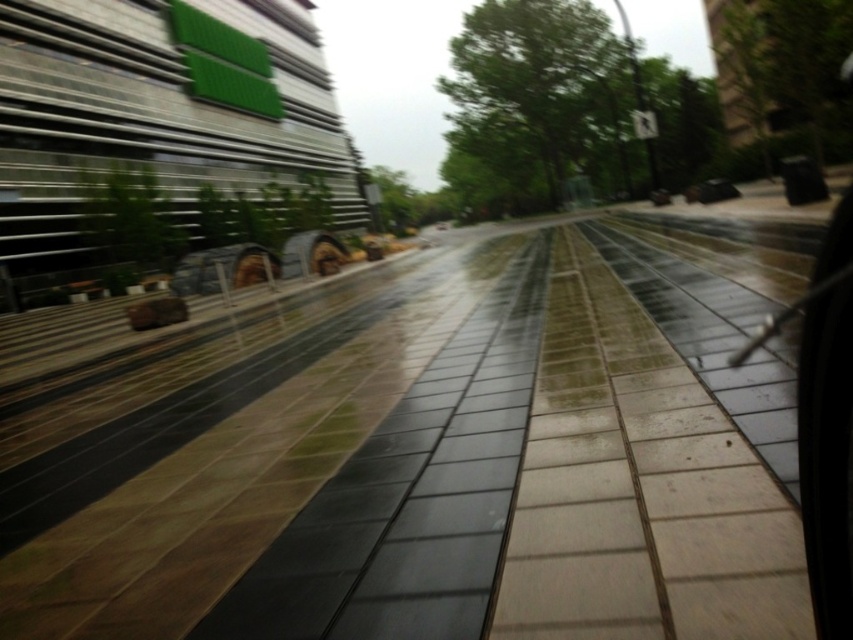
Between shiny concrete pavement at center and green glass passenger train at upper left, which one appears on the left side from the viewer's perspective?

From the viewer's perspective, green glass passenger train at upper left appears more on the left side.

From the picture: Who is more distant from viewer, [213,426] or [186,64]?

The point [186,64] is behind.

Which is in front, point (24, 456) or point (35, 243)?

Point (24, 456)

Find the location of a particular element. This screenshot has height=640, width=853. shiny concrete pavement at center is located at coordinates (416, 456).